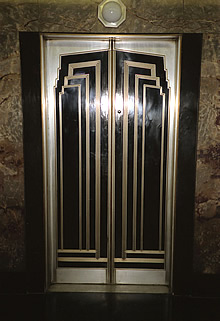
Where is `gray and brown wall`? The height and width of the screenshot is (321, 220). gray and brown wall is located at coordinates (77, 13), (217, 168), (9, 182).